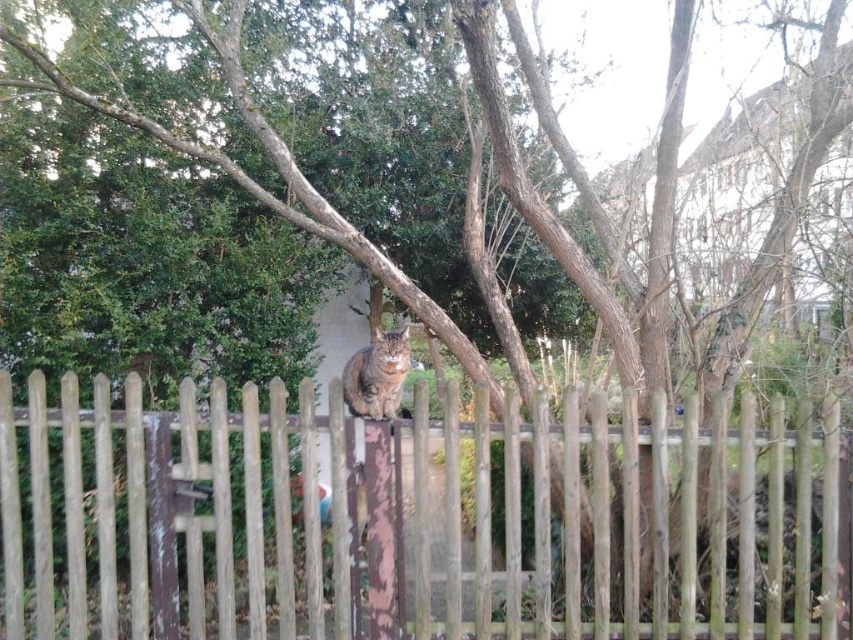
Who is higher up, weathered wood fence at center or tabby fur cat at center?

tabby fur cat at center

Does weathered wood fence at center appear on the left side of tabby fur cat at center?

Incorrect, weathered wood fence at center is not on the left side of tabby fur cat at center.

The height and width of the screenshot is (640, 853). Describe the element at coordinates (631, 518) in the screenshot. I see `weathered wood fence at center` at that location.

Identify the location of weathered wood fence at center. (631, 518).